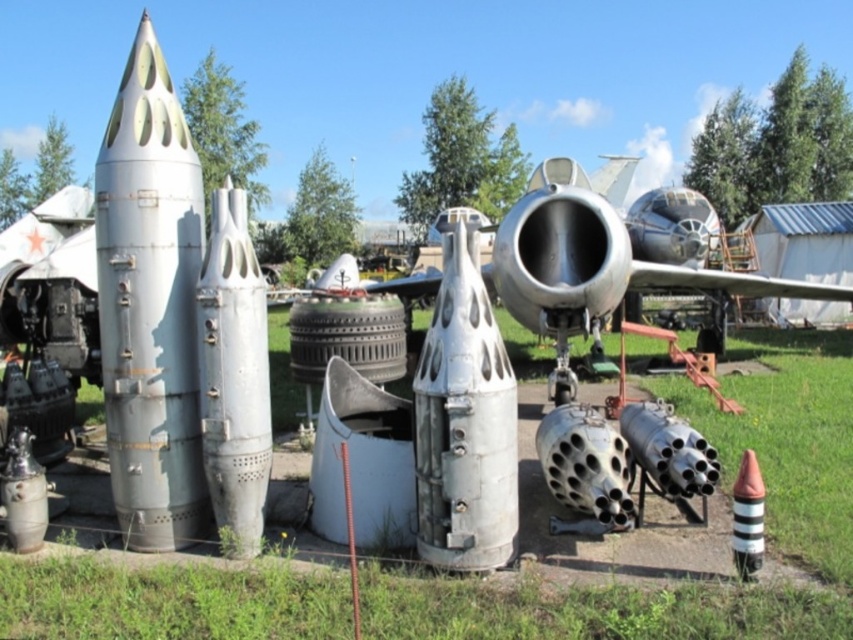
Consider the image. Does silver metallic rocket at center have a larger size compared to striped plastic cone at lower right?

Indeed, silver metallic rocket at center has a larger size compared to striped plastic cone at lower right.

Does point (241, 381) come in front of point (759, 502)?

No, (241, 381) is behind (759, 502).

You are a GUI agent. You are given a task and a screenshot of the screen. Output one action in this format:
    pyautogui.click(x=<x>, y=<y>)
    Task: Click on the silver metallic rocket at center
    The height and width of the screenshot is (640, 853).
    Given the screenshot: What is the action you would take?
    point(233,376)

Which of these two, green grass at center or brushed metal rocket at center, stands shorter?

green grass at center is shorter.

What do you see at coordinates (723, 486) in the screenshot?
I see `green grass at center` at bounding box center [723, 486].

The image size is (853, 640). I want to click on green grass at center, so click(x=723, y=486).

Is brushed metal rocket at center to the left of silver metallic rocket at center from the viewer's perspective?

Indeed, brushed metal rocket at center is positioned on the left side of silver metallic rocket at center.

Does brushed metal rocket at center have a smaller size compared to silver metallic rocket at center?

No, brushed metal rocket at center is not smaller than silver metallic rocket at center.

Does point (99, 214) lie behind point (260, 289)?

No, (99, 214) is closer to viewer.

Locate an element on the screen. Image resolution: width=853 pixels, height=640 pixels. brushed metal rocket at center is located at coordinates (149, 305).